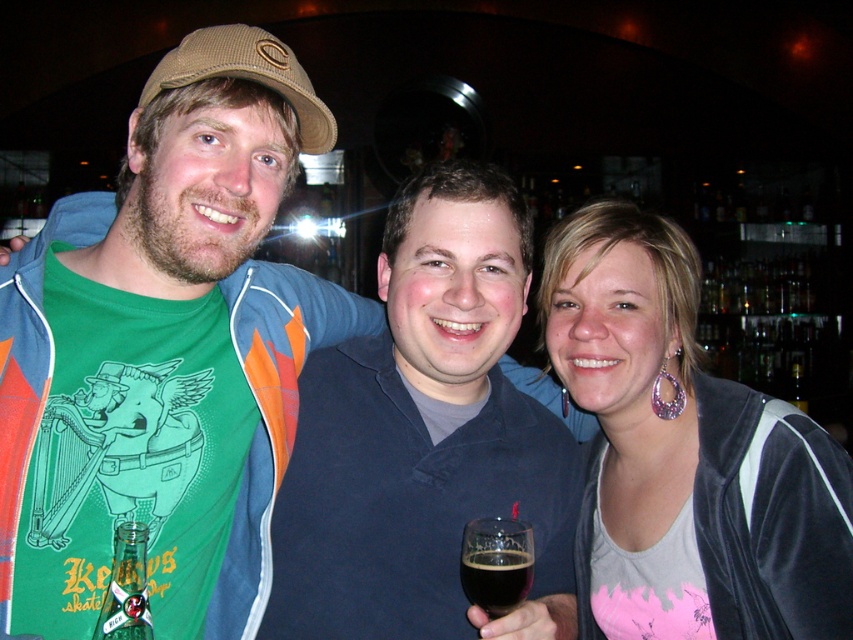
Can you confirm if matte black jacket at center is positioned above dark glass at center?

Yes, matte black jacket at center is above dark glass at center.

This screenshot has height=640, width=853. In order to click on matte black jacket at center in this screenshot , I will do `click(682, 452)`.

Is green fabric shirt at left below matte black jacket at center?

No.

Can you confirm if green fabric shirt at left is positioned above matte black jacket at center?

Indeed, green fabric shirt at left is positioned over matte black jacket at center.

Find the location of a particular element. green fabric shirt at left is located at coordinates (166, 349).

Between dark blue shirt at center and dark glass at center, which one is positioned higher?

Positioned higher is dark blue shirt at center.

Which is more to the right, dark blue shirt at center or dark glass at center?

dark glass at center is more to the right.

Find the location of `dark blue shirt at center`. dark blue shirt at center is located at coordinates (425, 436).